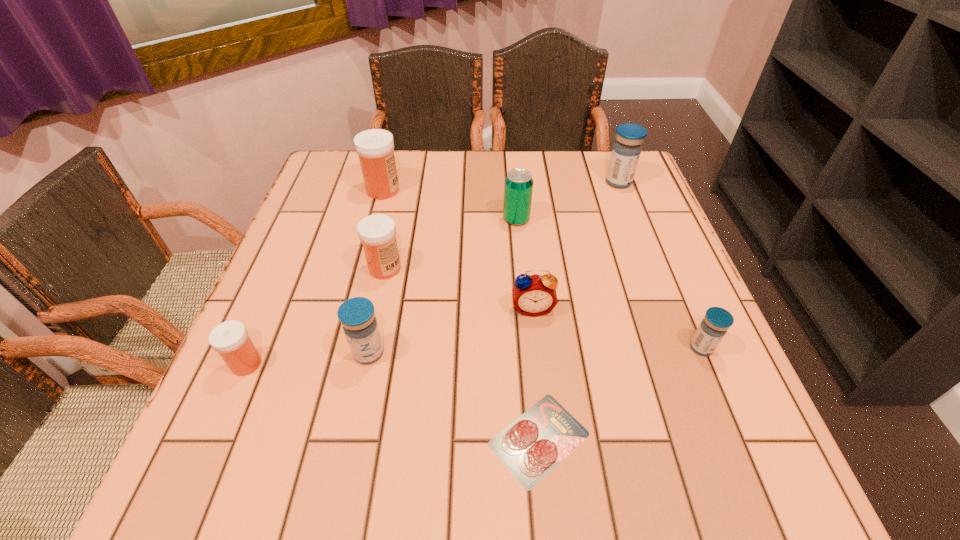
You are a GUI agent. You are given a task and a screenshot of the screen. Output one action in this format:
    pyautogui.click(x=<x>, y=<y>)
    Task: Click on the leftmost white medicine
    The image size is (960, 540).
    Given the screenshot: What is the action you would take?
    pyautogui.click(x=230, y=339)

Identify the location of the leftmost medicine. Image resolution: width=960 pixels, height=540 pixels. (230, 339).

Find the location of a particular element. the shortest object is located at coordinates (535, 443).

Where is `salami`? The height and width of the screenshot is (540, 960). salami is located at coordinates (535, 443).

In order to click on free space located 0.360m on the front of the biggest blue medicine in this screenshot , I will do `click(660, 292)`.

At what (x,y) coordinates should I click in order to perform the action: click on free location located on the front of the farthest white medicine. Please return your answer as a coordinate pair (x, y). This screenshot has height=540, width=960. Looking at the image, I should click on (371, 237).

Where is `vacant space located on the back of the beer can`? The width and height of the screenshot is (960, 540). vacant space located on the back of the beer can is located at coordinates (514, 190).

I want to click on vacant area located on the back of the leftmost blue medicine, so click(x=394, y=232).

At what (x,y) coordinates should I click in order to perform the action: click on vacant area situated 0.200m on the back of the second farthest white medicine. Please return your answer as a coordinate pair (x, y). This screenshot has height=540, width=960. Looking at the image, I should click on (399, 202).

You are a GUI agent. You are given a task and a screenshot of the screen. Output one action in this format:
    pyautogui.click(x=<x>, y=<y>)
    Task: Click on the free location located 0.060m on the front-facing side of the alarm clock
    The image size is (960, 540).
    Given the screenshot: What is the action you would take?
    pyautogui.click(x=537, y=343)